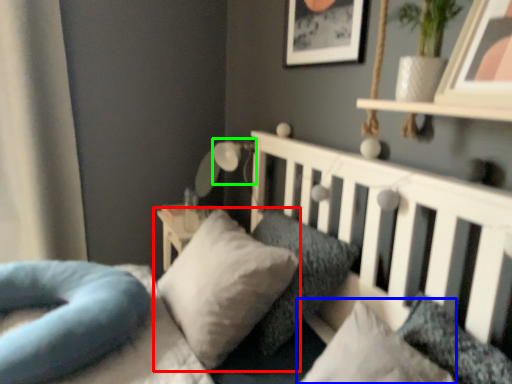
Question: Considering the real-world distances, which object is closest to pillow (highlighted by a red box)? pillow (highlighted by a blue box) or lamp (highlighted by a green box).

Choices:
 (A) pillow
 (B) lamp

Answer: (A)